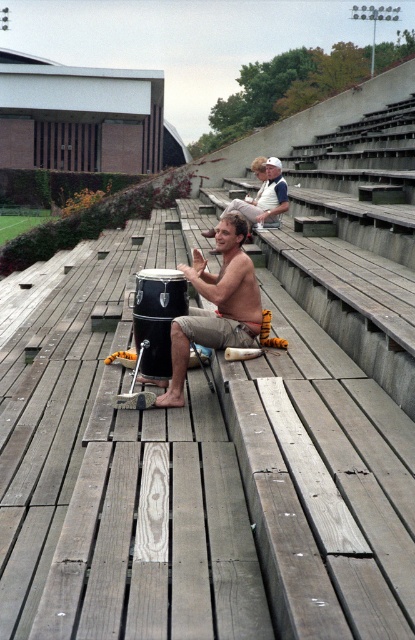
Can you confirm if shiny black drum at center is positioned above shiny silver drum at center?

Incorrect, shiny black drum at center is not positioned above shiny silver drum at center.

Between shiny black drum at center and shiny silver drum at center, which one has less height?

Standing shorter between the two is shiny black drum at center.

Between point (170, 352) and point (251, 224), which one is positioned behind?

Positioned behind is point (251, 224).

Where is `shiny black drum at center`? This screenshot has height=640, width=415. shiny black drum at center is located at coordinates (215, 305).